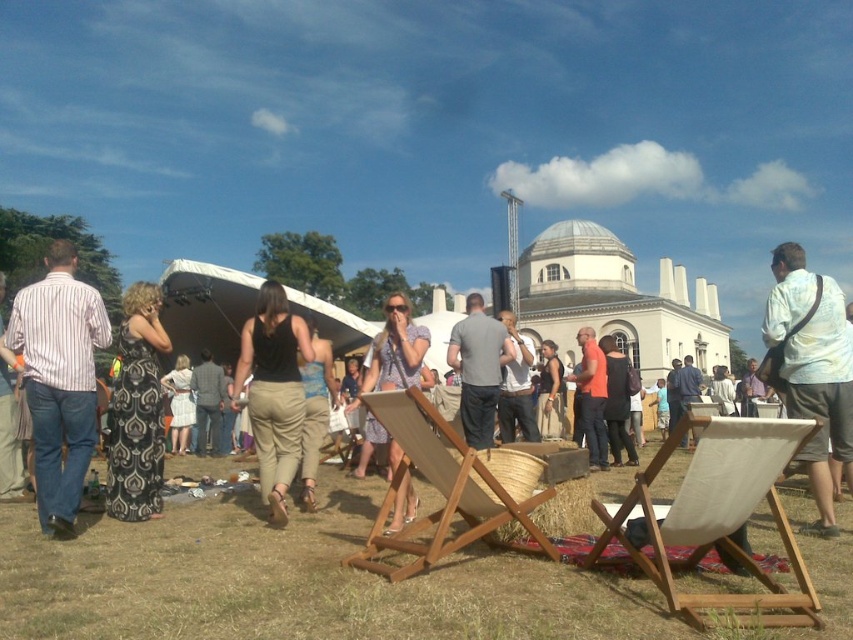
What is the 2D coordinate of the striped cotton shirt at left in the image?

The striped cotton shirt at left is located at the 2D coordinate point of (59, 380).

You are at a social gathering and see two people wearing a blue textured dress at center and a white cotton shirt at center. Which clothing item is higher up on the person?

The blue textured dress at center is above the white cotton shirt at center, so the blue textured dress at center is higher up on the person.